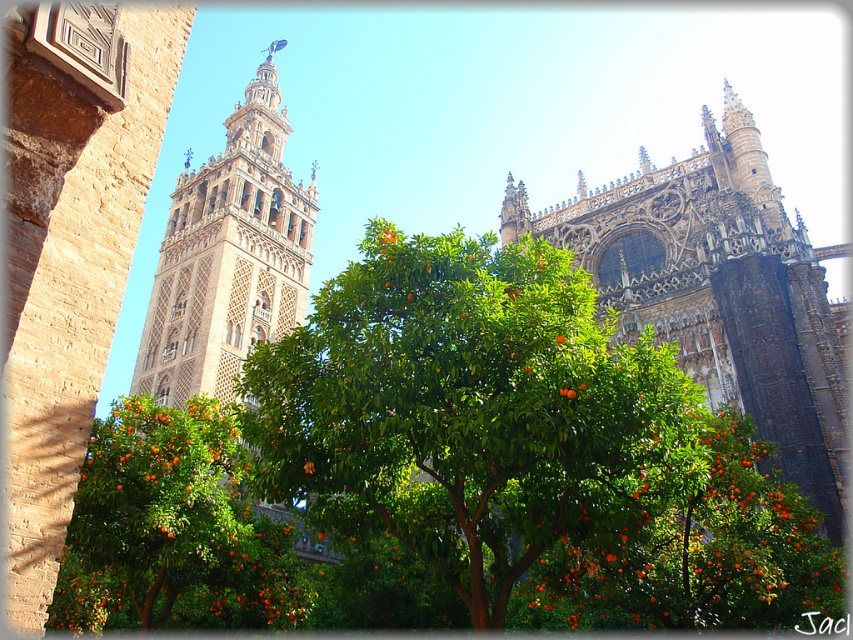
You are standing in front of the cathedral and want to take a photo of the green leafy tree at center. Which direction should you face to ensure the tree is in the frame?

The green leafy tree at center is located at point [469,410], which places it centrally in the image. Therefore, facing the cathedral facade directly should keep the tree in the frame.

Which tree is wider? The green leafy tree at center or the green leafy tree with orange fruits at center?

The green leafy tree at center is wider than the green leafy tree with orange fruits at center according to the description.

You are standing in front of the cathedral and want to take a photo of both the green leafy tree at center and the beige stone tower at left. Can you fit both in the frame without moving your position?

The green leafy tree at center is located below the beige stone tower at left, so yes, you can fit both in the frame by adjusting your camera angle to include both the lower tree and the taller tower.